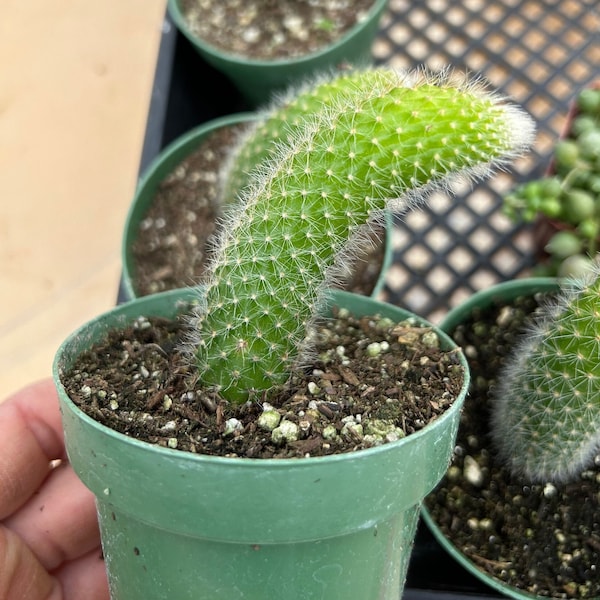
The height and width of the screenshot is (600, 600). I want to click on pot, so click(x=376, y=287).